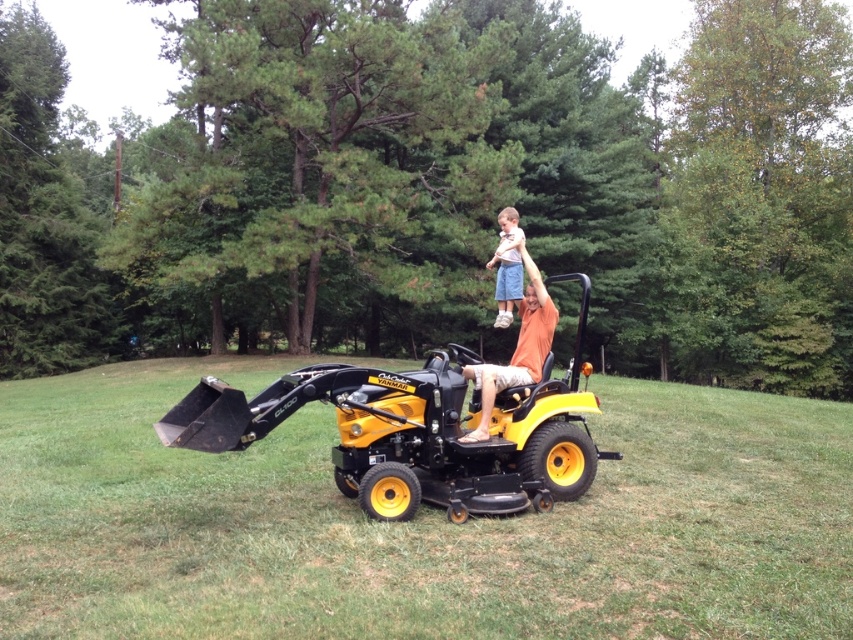
Question: Which object is farther from the camera taking this photo?

Choices:
 (A) green grass at center
 (B) orange cotton shirt at center

Answer: (B)

Question: Can you confirm if green grass at center is smaller than orange cotton shirt at center?

Choices:
 (A) no
 (B) yes

Answer: (A)

Question: Estimate the real-world distances between objects in this image. Which object is closer to the green grass at center?

Choices:
 (A) orange cotton shirt at center
 (B) light blue denim shorts at upper center

Answer: (B)

Question: Does orange cotton shirt at center have a lesser width compared to light blue denim shorts at upper center?

Choices:
 (A) no
 (B) yes

Answer: (B)

Question: Can you confirm if green grass at center is wider than orange cotton shirt at center?

Choices:
 (A) yes
 (B) no

Answer: (A)

Question: Estimate the real-world distances between objects in this image. Which object is closer to the light blue denim shorts at upper center?

Choices:
 (A) orange cotton shirt at center
 (B) green grass at center

Answer: (A)